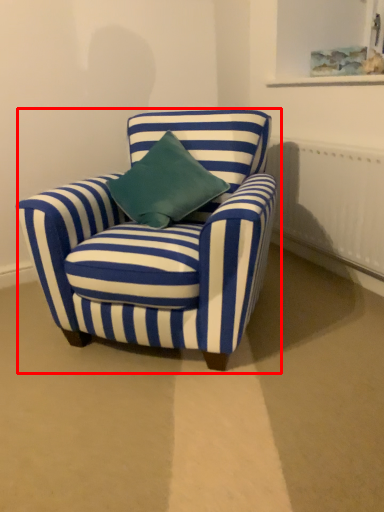
Question: Considering the relative positions of chair (annotated by the red box) and radiator in the image provided, where is chair (annotated by the red box) located with respect to the staircase?

Choices:
 (A) right
 (B) left

Answer: (B)